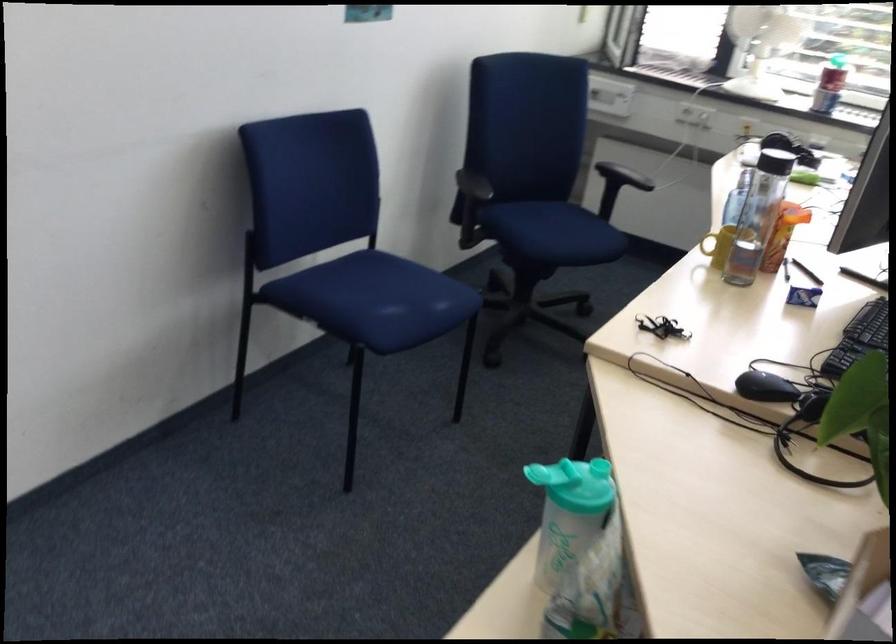
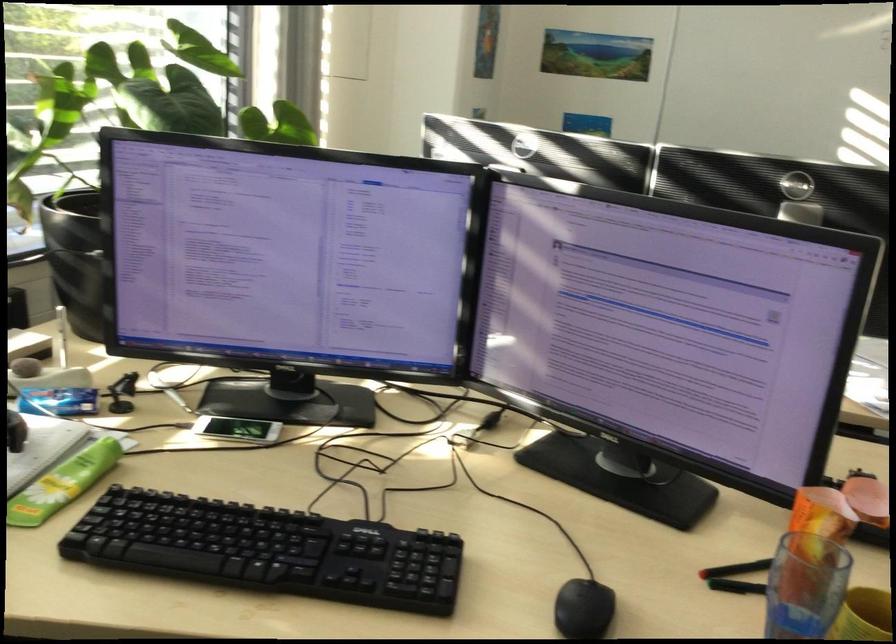
Find the pixel in the second image that matches point (787, 205) in the first image.

(822, 514)